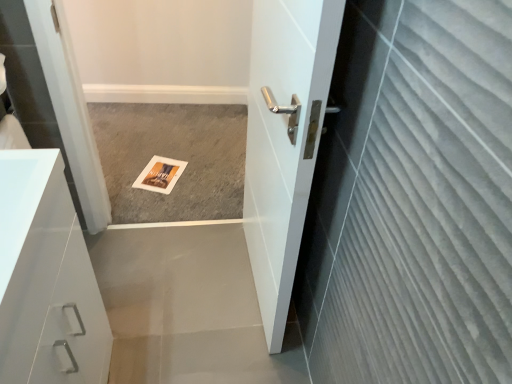
This screenshot has height=384, width=512. Describe the element at coordinates (46, 278) in the screenshot. I see `white glossy cabinet at left` at that location.

Image resolution: width=512 pixels, height=384 pixels. What do you see at coordinates (172, 158) in the screenshot?
I see `gray carpet at center` at bounding box center [172, 158].

What is the approximate height of white glossy door at center?

It is 4.12 feet.

You are a GUI agent. You are given a task and a screenshot of the screen. Output one action in this format:
    pyautogui.click(x=<x>, y=<y>)
    Task: Click on the white glossy cabinet at left
    This screenshot has height=384, width=512.
    Given the screenshot: What is the action you would take?
    pyautogui.click(x=46, y=278)

At what (x,y) coordinates should I click in order to perform the action: click on concrete behind the white glossy cabinet at left. Please return your answer as a coordinate pair (x, y). This screenshot has width=512, height=384. Looking at the image, I should click on (172, 158).

From a real-world perspective, is white glossy cabinet at left on top of gray carpet at center?

Yes, from a real-world perspective, white glossy cabinet at left is over gray carpet at center

Is the surface of white glossy cabinet at left in direct contact with gray carpet at center?

white glossy cabinet at left is not next to gray carpet at center, and they're not touching.

Does white glossy cabinet at left have a greater height compared to gray carpet at center?

Indeed, white glossy cabinet at left has a greater height compared to gray carpet at center.

Which point is more forward, (244, 171) or (29, 299)?

The point (29, 299) is closer.

From the image's perspective, which is below, gray carpet at center or white glossy cabinet at left?

white glossy cabinet at left, from the image's perspective.

Which of these two, gray carpet at center or white glossy cabinet at left, is thinner?

white glossy cabinet at left is thinner.

Is gray carpet at center in contact with white glossy cabinet at left?

They are not placed beside each other.

Is white glossy cabinet at left positioned with its back to white glossy door at center?

That's not correct — white glossy cabinet at left is not looking away from white glossy door at center.

Does white glossy cabinet at left appear on the right side of white glossy door at center?

No, white glossy cabinet at left is not to the right of white glossy door at center.

What are the coordinates of `bathroom cabinet below the white glossy door at center (from a real-world perspective)` in the screenshot? It's located at (46, 278).

Looking at this image, who is bigger, white glossy cabinet at left or white glossy door at center?

Bigger between the two is white glossy door at center.

From the picture: Measure the distance between white glossy door at center and gray carpet at center.

white glossy door at center and gray carpet at center are 34.92 inches apart.

Considering the positions of points (283, 51) and (123, 113), is point (283, 51) closer to camera compared to point (123, 113)?

Yes.

What's the angular difference between white glossy door at center and gray carpet at center's facing directions?

white glossy door at center and gray carpet at center are facing 86.5 degrees away from each other.

Are white glossy door at center and gray carpet at center far apart?

Actually, white glossy door at center and gray carpet at center are a little close together.

Can you confirm if white glossy door at center is bigger than white glossy cabinet at left?

Correct, white glossy door at center is larger in size than white glossy cabinet at left.

Looking at this image, are white glossy door at center and white glossy cabinet at left located far from each other?

No, white glossy door at center is in close proximity to white glossy cabinet at left.

From a real-world perspective, relative to white glossy cabinet at left, is white glossy door at center vertically above or below?

white glossy door at center is above white glossy cabinet at left.

Considering the relative sizes of white glossy door at center and white glossy cabinet at left in the image provided, is white glossy door at center wider than white glossy cabinet at left?

Incorrect, the width of white glossy door at center does not surpass that of white glossy cabinet at left.

Between gray carpet at center and white glossy door at center, which one is positioned in front?

white glossy door at center.

Is white glossy door at center at the back of gray carpet at center?

gray carpet at center does not have its back to white glossy door at center.

Which of these two, gray carpet at center or white glossy door at center, is thinner?

white glossy door at center.

From the image's perspective, is gray carpet at center on top of white glossy door at center?

Yes, from the image's perspective, gray carpet at center is above white glossy door at center.

At what (x,y) coordinates should I click in order to perform the action: click on bathroom cabinet located below the gray carpet at center (from the image's perspective). Please return your answer as a coordinate pair (x, y). This screenshot has height=384, width=512. Looking at the image, I should click on (46, 278).

Locate an element on the screen. Image resolution: width=512 pixels, height=384 pixels. concrete above the white glossy cabinet at left (from the image's perspective) is located at coordinates click(x=172, y=158).

Based on their spatial positions, is gray carpet at center or white glossy door at center closer to white glossy cabinet at left?

The object closer to white glossy cabinet at left is white glossy door at center.

Which object lies further to the anchor point white glossy cabinet at left, white glossy door at center or gray carpet at center?

gray carpet at center is positioned further to the anchor white glossy cabinet at left.

Estimate the real-world distances between objects in this image. Which object is closer to white glossy door at center, gray carpet at center or white glossy cabinet at left?

Among the two, white glossy cabinet at left is located nearer to white glossy door at center.

Estimate the real-world distances between objects in this image. Which object is closer to gray carpet at center, white glossy cabinet at left or white glossy door at center?

The object closer to gray carpet at center is white glossy door at center.

Based on their spatial positions, is white glossy cabinet at left or gray carpet at center closer to white glossy door at center?

white glossy cabinet at left is closer to white glossy door at center.

Estimate the real-world distances between objects in this image. Which object is closer to gray carpet at center, white glossy door at center or white glossy cabinet at left?

white glossy door at center.

Where is `door positioned between white glossy cabinet at left and gray carpet at center from near to far`? The width and height of the screenshot is (512, 384). door positioned between white glossy cabinet at left and gray carpet at center from near to far is located at coordinates (284, 140).